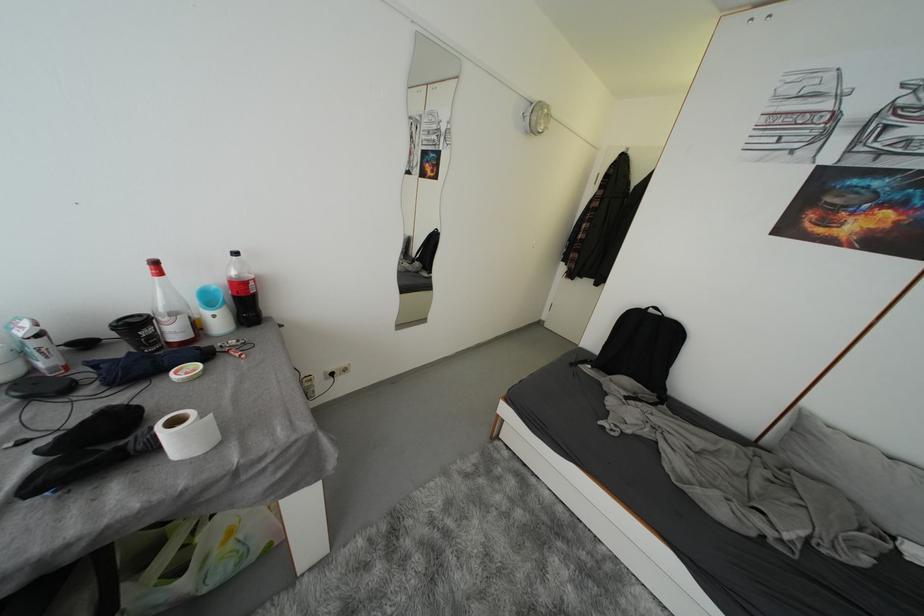
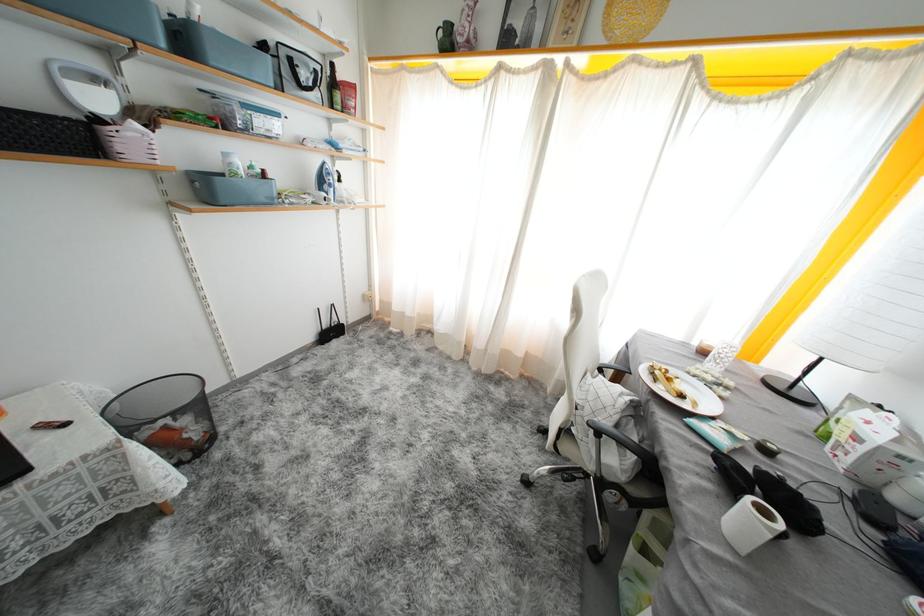
Locate, in the second image, the point that corresponds to point (180, 426) in the first image.

(770, 516)